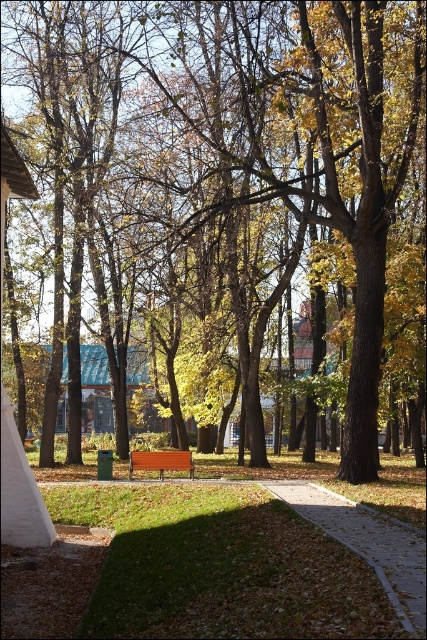
You are planning to place a 2.5 meter long decorative fence along the brown concrete sidewalk at center and the brown wooden bench at center. Based on their widths, which one can accommodate the fence without exceeding its width?

The brown wooden bench at center can accommodate the fence since its width is greater than the brown concrete sidewalk at center, which is narrower and might not fit the 2.5 meter fence.

You are standing at the point marked by the coordinates (368, 545) in the park scene. What object are you standing on?

You are standing on the brown concrete sidewalk at center located at point (368, 545).

You are a park visitor who wants to sit on the brown wooden bench at center. From your current position on the brown concrete sidewalk at center, which direction should you move to reach it?

The brown wooden bench at center is located below the brown concrete sidewalk at center, so you should move downward to reach it.